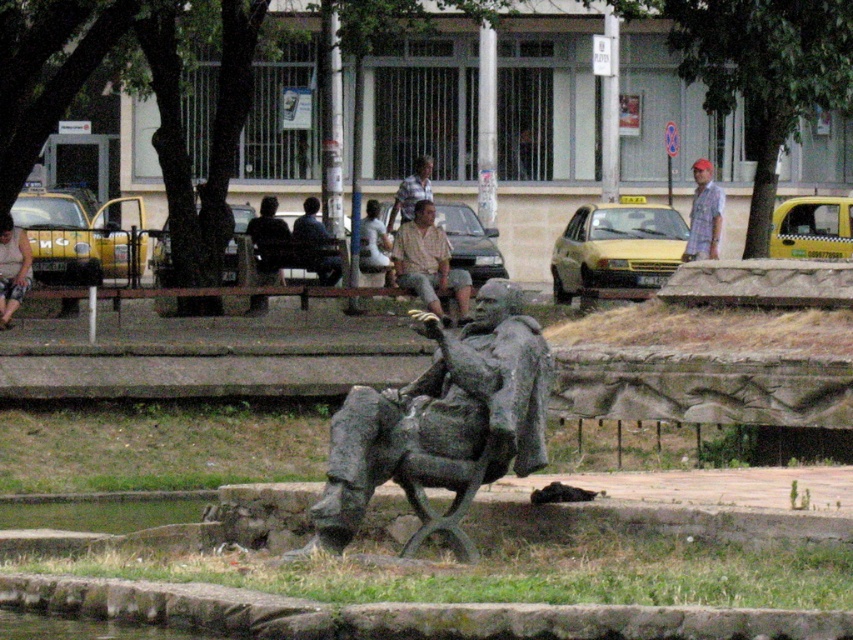
You are a photographer taking a picture of the statue in the park. You notice two people wearing the matte black shirt at left and the light brown fabric shirt at center. Which person will be more visible in your photo?

The matte black shirt at left is in front of the light brown fabric shirt at center, so the person wearing the matte black shirt at left will be more visible in the photo as they are closer to the camera.

You are a photographer standing in front of the statue. You want to take a photo that includes both the dark blue shirt at center and the light brown fabric shirt at center. Which shirt should you focus on first to ensure both are in the frame?

You should focus on the dark blue shirt at center first since it is closer to you than the light brown fabric shirt at center, ensuring both are in the frame.

You are standing in the park and see the matte gray statue at center and the light brown fabric shirt at center. Which object is positioned to the left?

The matte gray statue at center is positioned to the left of the light brown fabric shirt at center.